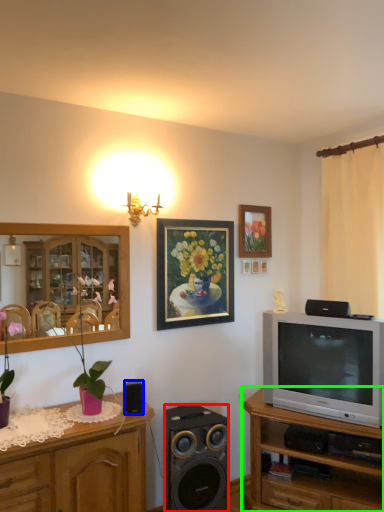
Question: Considering the real-world distances, which object is farthest from speaker (highlighted by a red box)? speaker (highlighted by a blue box) or cabinetry (highlighted by a green box)?

Choices:
 (A) speaker
 (B) cabinetry

Answer: (A)